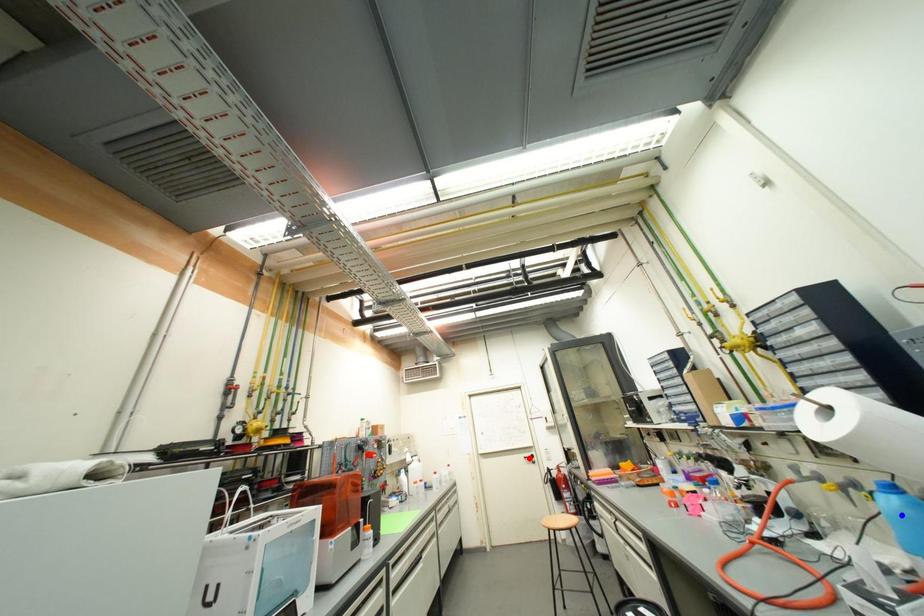
Question: In the image, two points are highlighted. Which point is nearer to the camera? Reply with the corresponding letter.

Choices:
 (A) blue point
 (B) red point

Answer: (A)